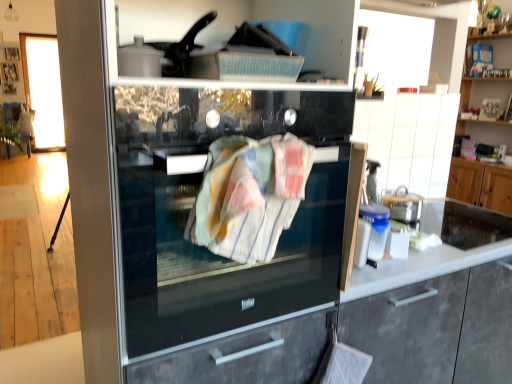
Question: Is black glass fridge at center facing towards white glossy countertop at right?

Choices:
 (A) no
 (B) yes

Answer: (A)

Question: Can you confirm if black glass fridge at center is shorter than white glossy countertop at right?

Choices:
 (A) no
 (B) yes

Answer: (A)

Question: Is white glossy countertop at right inside black glass fridge at center?

Choices:
 (A) no
 (B) yes

Answer: (A)

Question: Is black glass fridge at center oriented away from white glossy countertop at right?

Choices:
 (A) yes
 (B) no

Answer: (B)

Question: Considering the relative sizes of black glass fridge at center and white glossy countertop at right in the image provided, is black glass fridge at center taller than white glossy countertop at right?

Choices:
 (A) yes
 (B) no

Answer: (A)

Question: From the image's perspective, is black glass fridge at center located beneath white glossy countertop at right?

Choices:
 (A) yes
 (B) no

Answer: (A)

Question: Is wooden cabinet at upper right, placed as the 3th cabinetry when sorted from front to back, further to camera compared to white tile cabinetry at upper right, the 3th cabinetry from the right?

Choices:
 (A) no
 (B) yes

Answer: (B)

Question: Is wooden cabinet at upper right, acting as the 1th cabinetry starting from the back, positioned in front of white tile cabinetry at upper right, the second cabinetry from the back?

Choices:
 (A) yes
 (B) no

Answer: (B)

Question: Can you confirm if wooden cabinet at upper right, placed as the 3th cabinetry when sorted from front to back, is positioned to the right of white tile cabinetry at upper right, marked as the first cabinetry in a left-to-right arrangement?

Choices:
 (A) yes
 (B) no

Answer: (A)

Question: Considering the relative sizes of wooden cabinet at upper right, acting as the 1th cabinetry starting from the back, and white tile cabinetry at upper right, positioned as the second cabinetry in front-to-back order, in the image provided, is wooden cabinet at upper right, acting as the 1th cabinetry starting from the back, bigger than white tile cabinetry at upper right, positioned as the second cabinetry in front-to-back order,?

Choices:
 (A) yes
 (B) no

Answer: (A)

Question: From the image's perspective, is wooden cabinet at upper right, marked as the first cabinetry in a right-to-left arrangement, on white tile cabinetry at upper right, marked as the first cabinetry in a left-to-right arrangement?

Choices:
 (A) no
 (B) yes

Answer: (B)

Question: Can we say wooden cabinet at upper right, placed as the 3th cabinetry when sorted from front to back, lies outside white tile cabinetry at upper right, the 3th cabinetry from the right?

Choices:
 (A) no
 (B) yes

Answer: (B)

Question: Does white glossy countertop at right have a smaller size compared to black glass fridge at center?

Choices:
 (A) no
 (B) yes

Answer: (B)